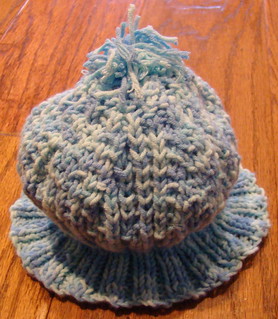
Where is `hardwood floor`? This screenshot has width=278, height=319. hardwood floor is located at coordinates (237, 306).